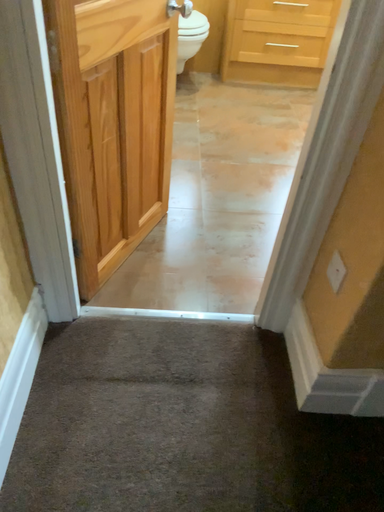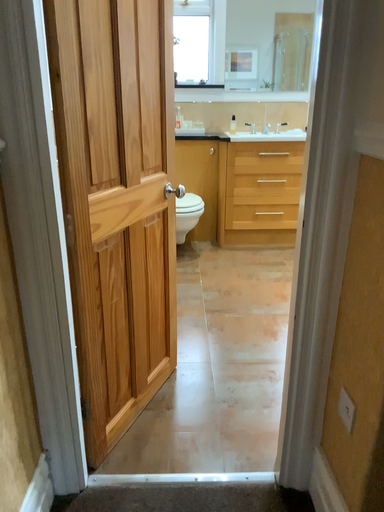
Question: How did the camera likely rotate when shooting the video?

Choices:
 (A) rotated downward
 (B) rotated upward

Answer: (B)